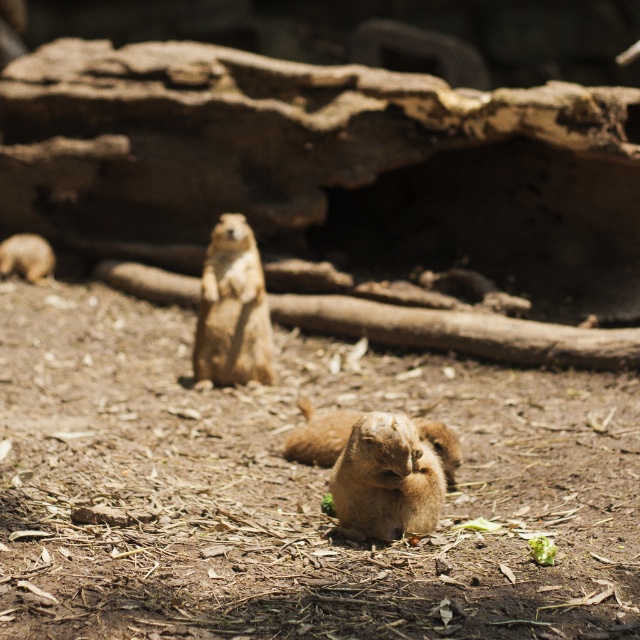
Is golden fur squirrel at center below brown furry squirrel at left?

Indeed, golden fur squirrel at center is positioned under brown furry squirrel at left.

Between point (205, 356) and point (19, 252), which one is positioned in front?

Point (205, 356) is more forward.

Image resolution: width=640 pixels, height=640 pixels. Find the location of `golden fur squirrel at center`. golden fur squirrel at center is located at coordinates (232, 308).

The image size is (640, 640). In order to click on golden fur squirrel at center in this screenshot , I will do `click(232, 308)`.

Who is positioned more to the right, golden fur squirrel at center or fuzzy brown squirrel at center?

fuzzy brown squirrel at center is more to the right.

Measure the distance from golden fur squirrel at center to fuzzy brown squirrel at center.

golden fur squirrel at center is 38.41 inches from fuzzy brown squirrel at center.

Which is in front, point (221, 342) or point (307, 458)?

Point (307, 458) is more forward.

This screenshot has height=640, width=640. In order to click on golden fur squirrel at center in this screenshot , I will do `click(232, 308)`.

Can you confirm if fuzzy brown squirrel at center is positioned above brown furry squirrel at left?

No, fuzzy brown squirrel at center is not above brown furry squirrel at left.

How distant is fuzzy brown squirrel at center from brown furry squirrel at left?

fuzzy brown squirrel at center and brown furry squirrel at left are 3.21 meters apart from each other.

Who is more forward, (456,458) or (19,262)?

Positioned in front is point (456,458).

The width and height of the screenshot is (640, 640). I want to click on fuzzy brown squirrel at center, so click(317, 435).